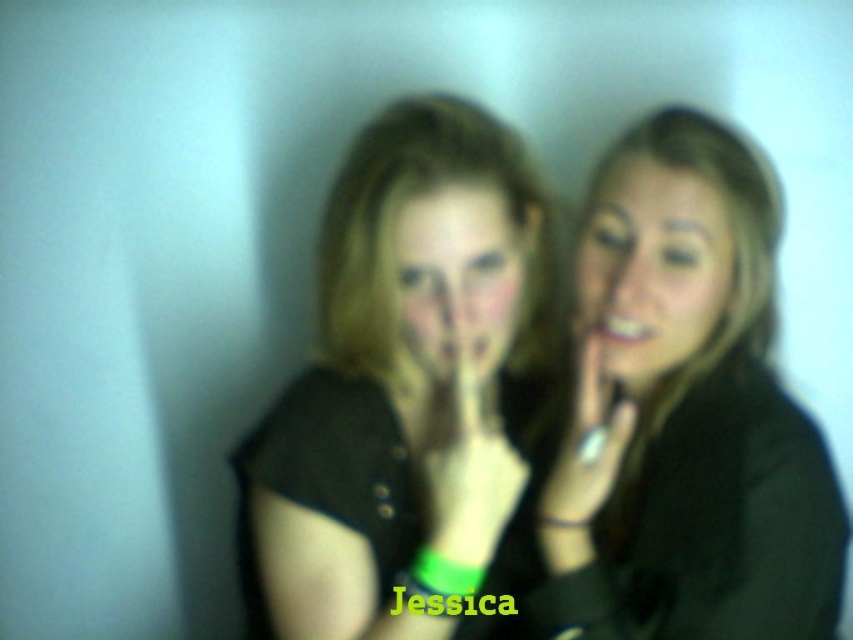
Based on the scene description, can you determine if the matte black face at center is wider than the smooth skin hand at center?

The matte black face at center is wider than the smooth skin hand at center according to the description.

Based on the photo, you are standing in front of the image and want to know the distance between you and the point at coordinates point (x=456, y=628). Can you estimate how far it is?

The distance between you and the point (x=456, y=628) is 36.58 inches.

You are a photographer trying to decide which of the two black shirts in the image to focus on. Given that both the matte black shirt at center and the smooth black shirt at center are in the frame, which one would you choose to zoom in on if you want to capture more details due to its size?

The matte black shirt at center is larger in width than the smooth black shirt at center, so choosing to zoom in on the matte black shirt at center would allow you to capture more details due to its larger size.